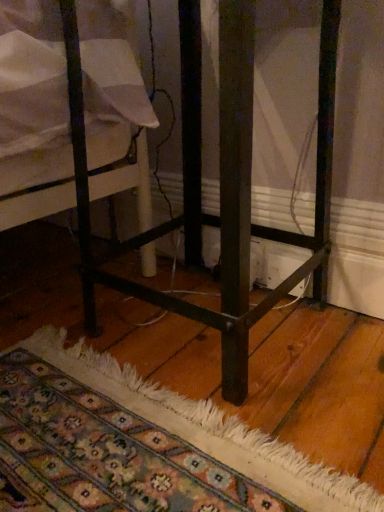
The image size is (384, 512). Identify the location of free spot in front of metallic black bed frame at center. (211, 429).